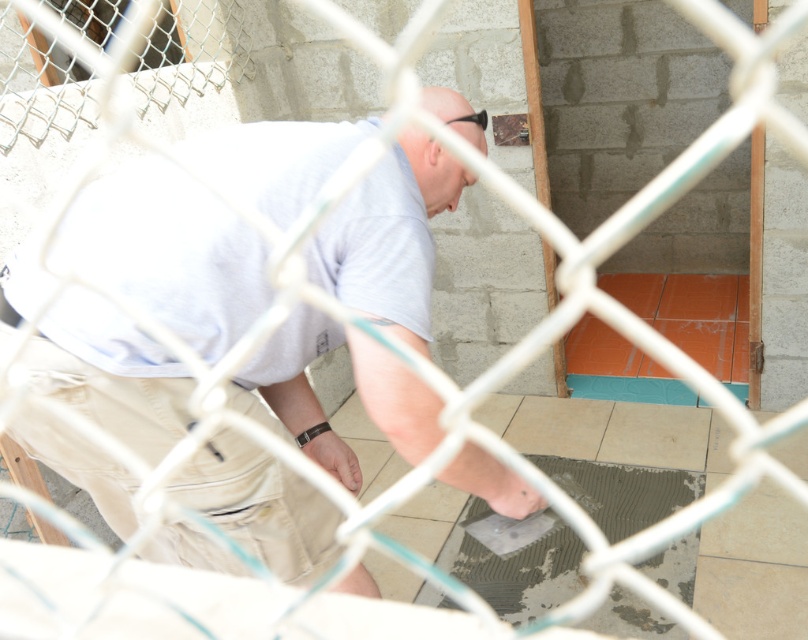
Who is shorter, light gray shirt at center or beige ceramic tile at center?

beige ceramic tile at center is shorter.

Is light gray shirt at center taller than beige ceramic tile at center?

Yes, light gray shirt at center is taller than beige ceramic tile at center.

Which is in front, point (377, 244) or point (701, 460)?

Positioned in front is point (377, 244).

Where is `light gray shirt at center`? light gray shirt at center is located at coordinates (170, 253).